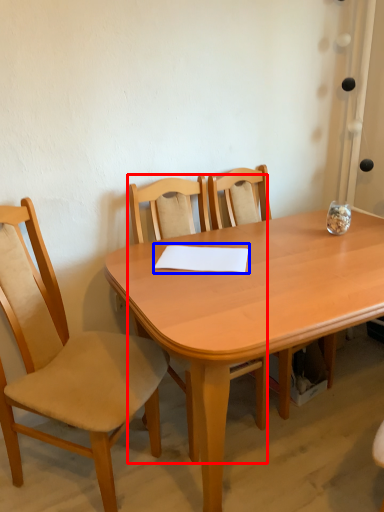
Question: Which object is closer to the camera taking this photo, chair (highlighted by a red box) or notepad (highlighted by a blue box)?

Choices:
 (A) chair
 (B) notepad

Answer: (A)